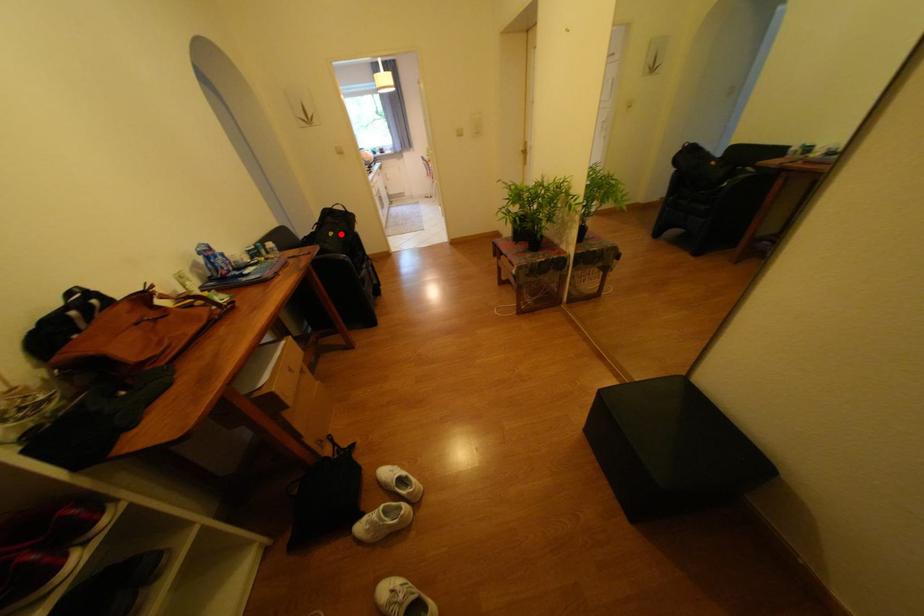
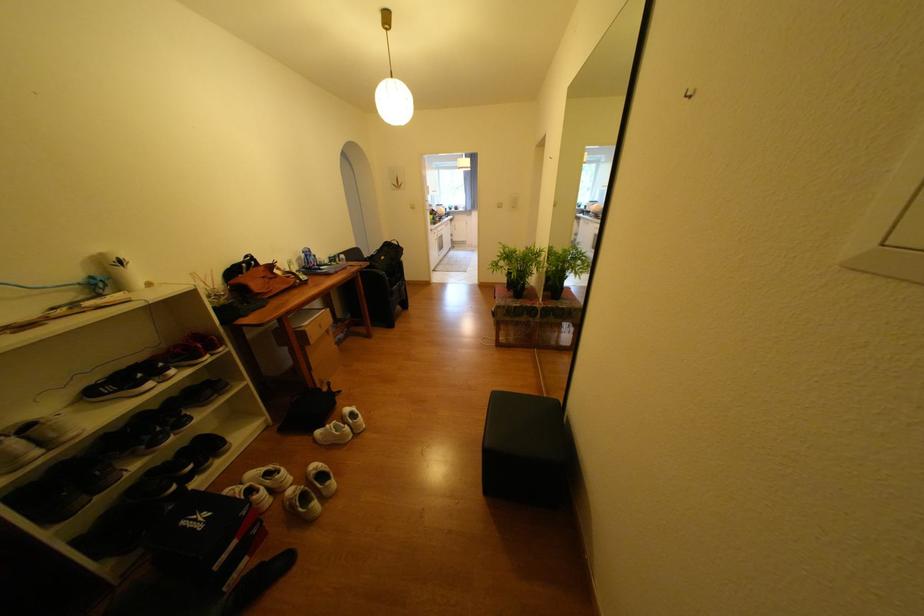
In the second image, find the point that corresponds to the highlighted location in the first image.

(392, 257)